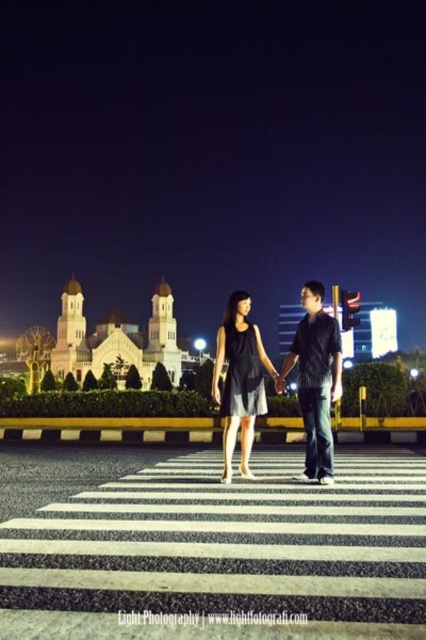
Can you confirm if dark blue jeans at center is positioned above matte black dress at center?

No, dark blue jeans at center is not above matte black dress at center.

Who is more distant from viewer, (307, 412) or (245, 349)?

Point (245, 349)

Which is in front, point (310, 468) or point (250, 401)?

Point (310, 468)

Image resolution: width=426 pixels, height=640 pixels. What are the coordinates of `dark blue jeans at center` in the screenshot? It's located at (316, 380).